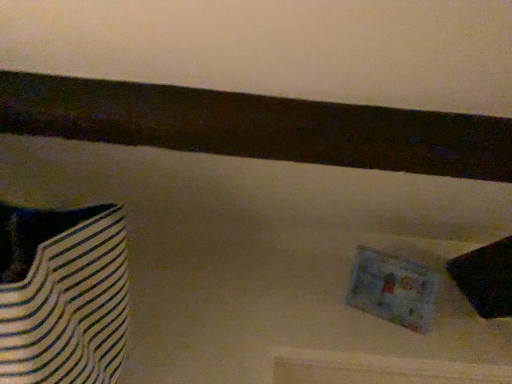
In order to face white striped fabric bag at left, should I rotate leftwards or rightwards?

Rotate left and turn 30.293 degrees.

At what (x,y) coordinates should I click in order to perform the action: click on white striped fabric bag at left. Please return your answer as a coordinate pair (x, y). Looking at the image, I should click on (63, 295).

The image size is (512, 384). What do you see at coordinates (63, 295) in the screenshot?
I see `white striped fabric bag at left` at bounding box center [63, 295].

I want to click on white striped fabric bag at left, so click(63, 295).